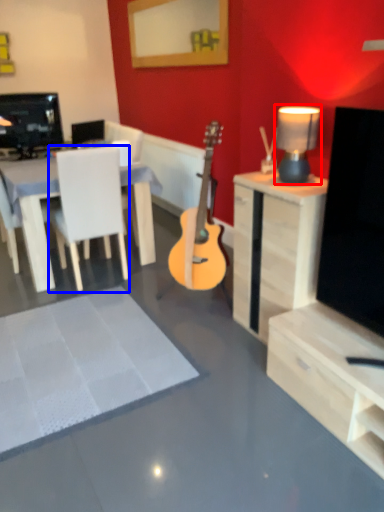
Question: Which object is further to the camera taking this photo, lamp (highlighted by a red box) or chair (highlighted by a blue box)?

Choices:
 (A) lamp
 (B) chair

Answer: (B)